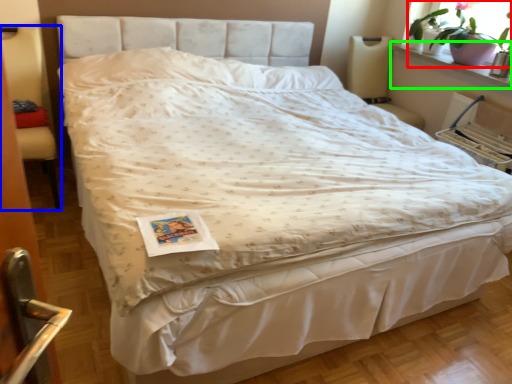
Question: Based on their relative distances, which object is nearer to houseplant (highlighted by a red box)? Choose from armchair (highlighted by a blue box) and window sill (highlighted by a green box).

Choices:
 (A) armchair
 (B) window sill

Answer: (B)